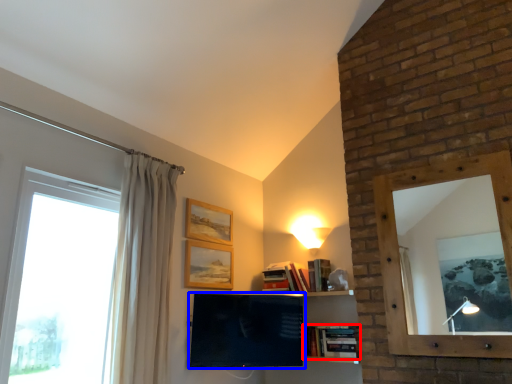
Question: Among these objects, which one is farthest to the camera, book (highlighted by a red box) or television (highlighted by a blue box)?

Choices:
 (A) book
 (B) television

Answer: (A)